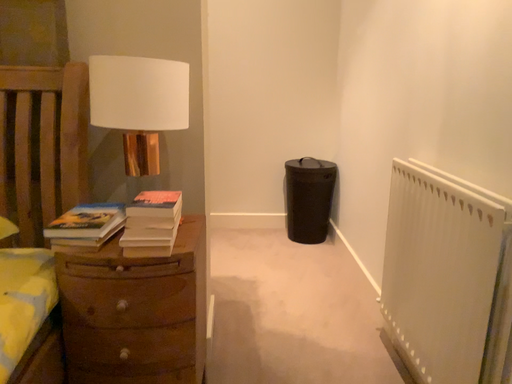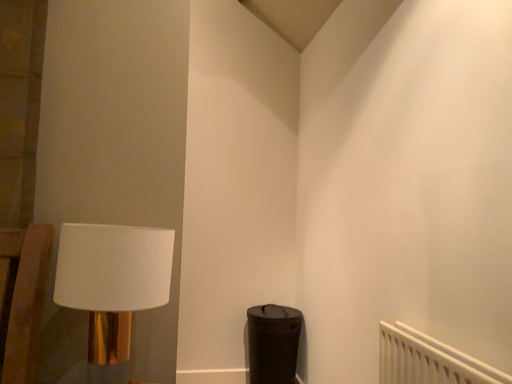
Question: Which way did the camera rotate in the video?

Choices:
 (A) rotated downward
 (B) rotated upward

Answer: (B)